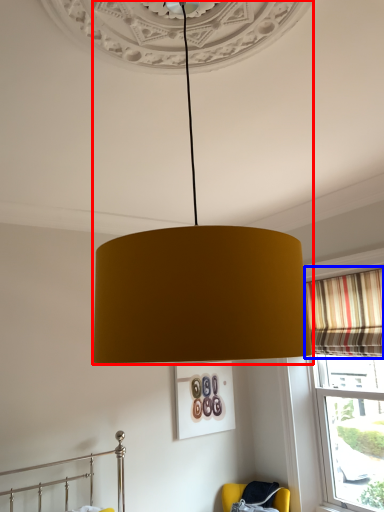
Question: Which of the following is the farthest to the observer, lamp (highlighted by a red box) or curtain (highlighted by a blue box)?

Choices:
 (A) lamp
 (B) curtain

Answer: (B)